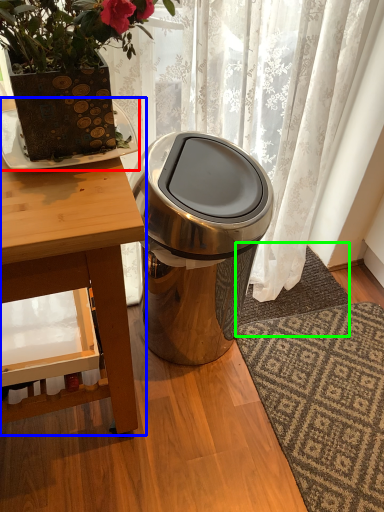
Question: Based on their relative distances, which object is nearer to plate (highlighted by a red box)? Choose from table (highlighted by a blue box) and doormat (highlighted by a green box).

Choices:
 (A) table
 (B) doormat

Answer: (A)